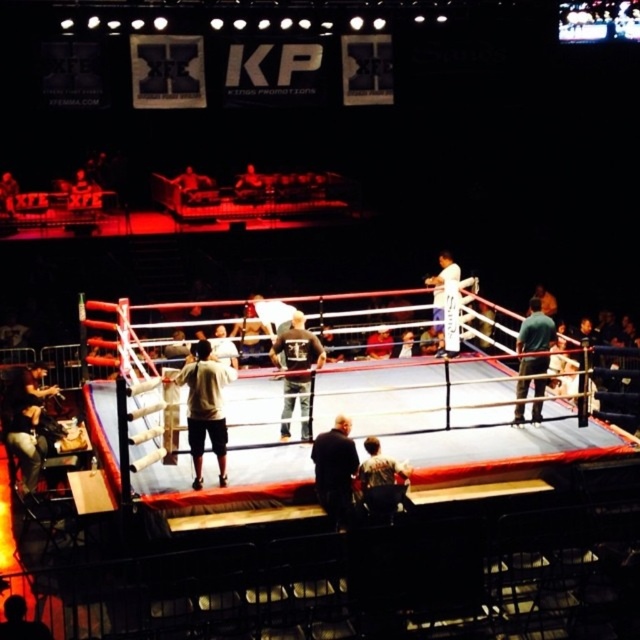
Does dark gray sweatshirt at center appear under green fabric shirt at center?

Yes.

The height and width of the screenshot is (640, 640). Identify the location of dark gray sweatshirt at center. (296, 371).

This screenshot has width=640, height=640. Identify the location of dark gray sweatshirt at center. (296, 371).

Which is in front, point (317, 468) or point (520, 387)?

Point (317, 468) is in front.

You are a GUI agent. You are given a task and a screenshot of the screen. Output one action in this format:
    pyautogui.click(x=<x>, y=<y>)
    Task: Click on the dark brown leather jacket at center
    Image resolution: width=640 pixels, height=640 pixels.
    Given the screenshot: What is the action you would take?
    pyautogui.click(x=336, y=470)

The width and height of the screenshot is (640, 640). Find the location of `dark brown leather jacket at center`. dark brown leather jacket at center is located at coordinates (336, 470).

Is dark brown leather jacket at center to the right of dark gray sweatshirt at center from the viewer's perspective?

Indeed, dark brown leather jacket at center is positioned on the right side of dark gray sweatshirt at center.

Who is more forward, (323, 477) or (289, 426)?

Positioned in front is point (323, 477).

You are a GUI agent. You are given a task and a screenshot of the screen. Output one action in this format:
    pyautogui.click(x=<x>, y=<y>)
    Task: Click on the dark brown leather jacket at center
    The image size is (640, 640).
    Given the screenshot: What is the action you would take?
    pyautogui.click(x=336, y=470)